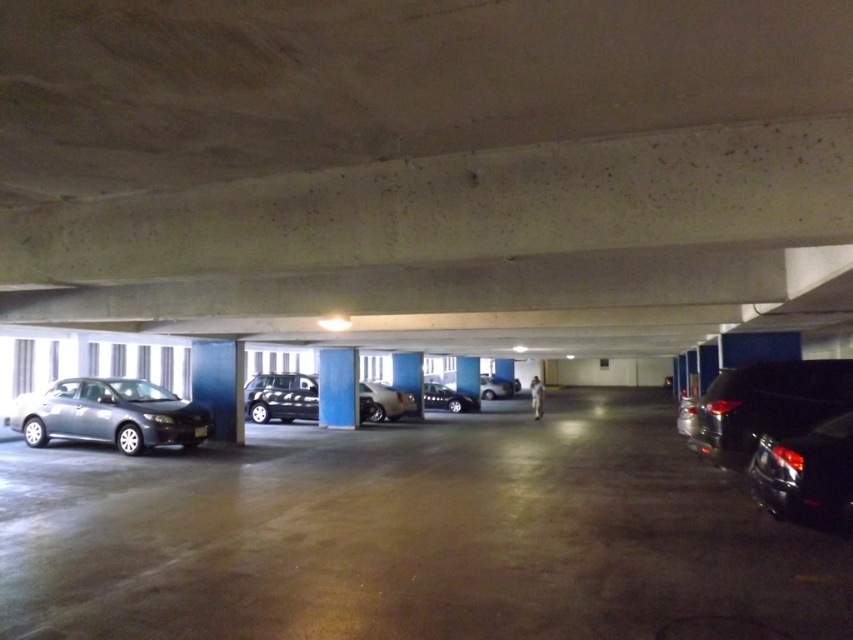
Who is more forward, (801, 513) or (485, 384)?

Positioned in front is point (801, 513).

Which is behind, point (842, 518) or point (492, 381)?

Positioned behind is point (492, 381).

Does point (808, 502) come in front of point (497, 381)?

Yes, point (808, 502) is in front of point (497, 381).

The width and height of the screenshot is (853, 640). In order to click on black glossy car at right in this screenshot , I will do coord(805,474).

Is point (775, 380) farther from camera compared to point (842, 420)?

Yes, it is.

Which of these two, black matte car at right or black glossy car at right, stands taller?

black matte car at right is taller.

Is point (743, 452) less distant than point (788, 464)?

No, it is not.

The height and width of the screenshot is (640, 853). Find the location of `black matte car at right`. black matte car at right is located at coordinates (766, 404).

Does black matte car at right have a greater width compared to satin black sedan at center?

In fact, black matte car at right might be narrower than satin black sedan at center.

Which of these two, black matte car at right or satin black sedan at center, stands shorter?

satin black sedan at center is shorter.

The height and width of the screenshot is (640, 853). Describe the element at coordinates (766, 404) in the screenshot. I see `black matte car at right` at that location.

Where is `black matte car at right`? The image size is (853, 640). black matte car at right is located at coordinates (766, 404).